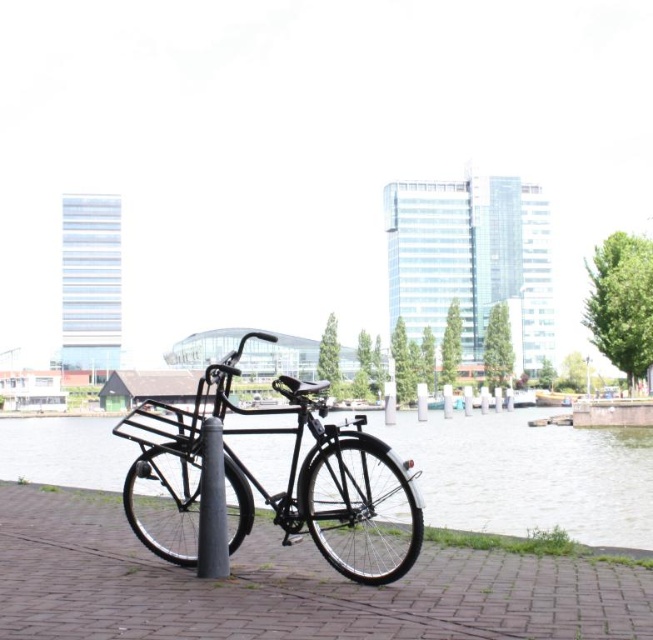
You are an urban planner evaluating the space in this waterfront area. You need to determine if there is enough room to place a new bench that is the same size as the matte black bicycle at center. Based on the scene, can the clear water at center area accommodate the bench?

The clear water at center is bigger than the matte black bicycle at center, so the area could potentially accommodate a bench of the same size as the bicycle.

You are standing at the origin point of the scene. Where is the black brick pavement at center located in terms of coordinates?

The black brick pavement at center is located at coordinates point (287, 586).

You are standing at the point with coordinates [287,586] in the urban waterfront scene. What surface are you currently standing on?

The point at coordinates [287,586] indicates black brick pavement at center, so you are standing on the black brick pavement at center.